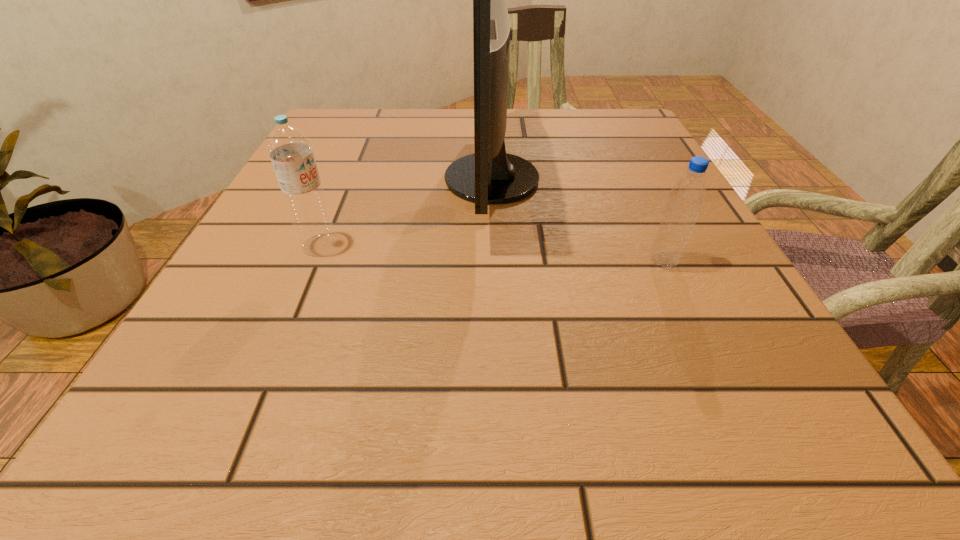
Locate an element on the screen. This screenshot has height=540, width=960. monitor is located at coordinates (489, 176).

What are the coordinates of `the tallest object` in the screenshot? It's located at (489, 176).

You are a GUI agent. You are given a task and a screenshot of the screen. Output one action in this format:
    pyautogui.click(x=<x>, y=<y>)
    Task: Click on the second tallest object
    
    Given the screenshot: What is the action you would take?
    pyautogui.click(x=290, y=150)

Where is `the leftmost object`? This screenshot has width=960, height=540. the leftmost object is located at coordinates (290, 150).

I want to click on the shorter water bottle, so click(x=687, y=196).

Image resolution: width=960 pixels, height=540 pixels. What are the coordinates of `the shortest object` in the screenshot? It's located at (687, 196).

Locate an element on the screen. Image resolution: width=960 pixels, height=540 pixels. free location located 0.210m on the screen side of the monitor is located at coordinates (341, 179).

Find the location of a particular element. The width and height of the screenshot is (960, 540). free location located 0.230m on the screen side of the monitor is located at coordinates (331, 179).

Find the location of a particular element. Image resolution: width=960 pixels, height=540 pixels. free spot located 0.320m on the screen side of the monitor is located at coordinates (287, 179).

This screenshot has width=960, height=540. I want to click on blank space located 0.100m on the right of the leftmost object, so click(x=397, y=245).